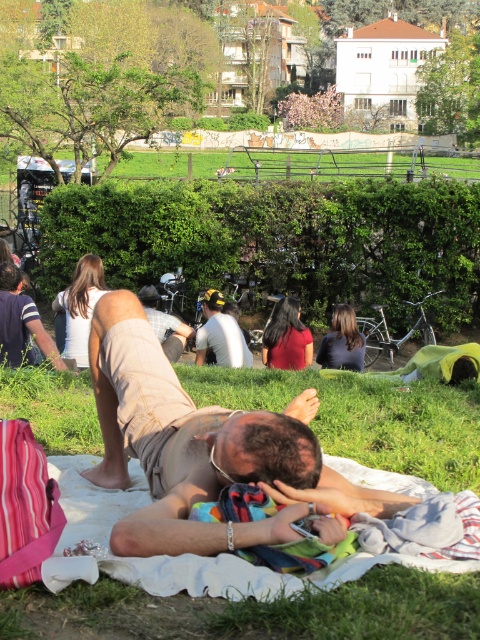
Which is behind, point (144, 460) or point (197, 362)?

The point (197, 362) is more distant.

Can you confirm if tan cotton shorts at lower center is smaller than white matte shirt at center?

Actually, tan cotton shorts at lower center might be larger than white matte shirt at center.

The width and height of the screenshot is (480, 640). What are the coordinates of `tan cotton shorts at lower center` in the screenshot? It's located at (204, 451).